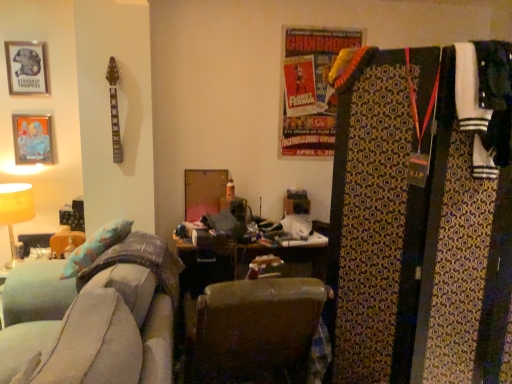
Question: Based on their sizes in the image, would you say soft gray fabric couch at lower left is bigger or smaller than white jersey at right?

Choices:
 (A) small
 (B) big

Answer: (B)

Question: Considering the relative positions of soft gray fabric couch at lower left and white jersey at right in the image provided, is soft gray fabric couch at lower left to the left or to the right of white jersey at right?

Choices:
 (A) left
 (B) right

Answer: (A)

Question: Which object is the farthest from the patterned fabric tie at right?

Choices:
 (A) leather at center
 (B) white jersey at right
 (C) soft gray fabric couch at lower left
 (D) metallic silver picture frame at upper left, placed as the 1th picture frame when sorted from top to bottom
 (E) metallic silver picture frame at upper left, which is the 1th picture frame in bottom-to-top order

Answer: (D)

Question: Which object is the farthest from the soft gray fabric couch at lower left?

Choices:
 (A) metallic silver picture frame at upper left, which is counted as the 2th picture frame, starting from the bottom
 (B) white jersey at right
 (C) leather at center
 (D) metallic silver picture frame at upper left, which is the 1th picture frame in bottom-to-top order
 (E) matte yellow table lamp at left

Answer: (A)